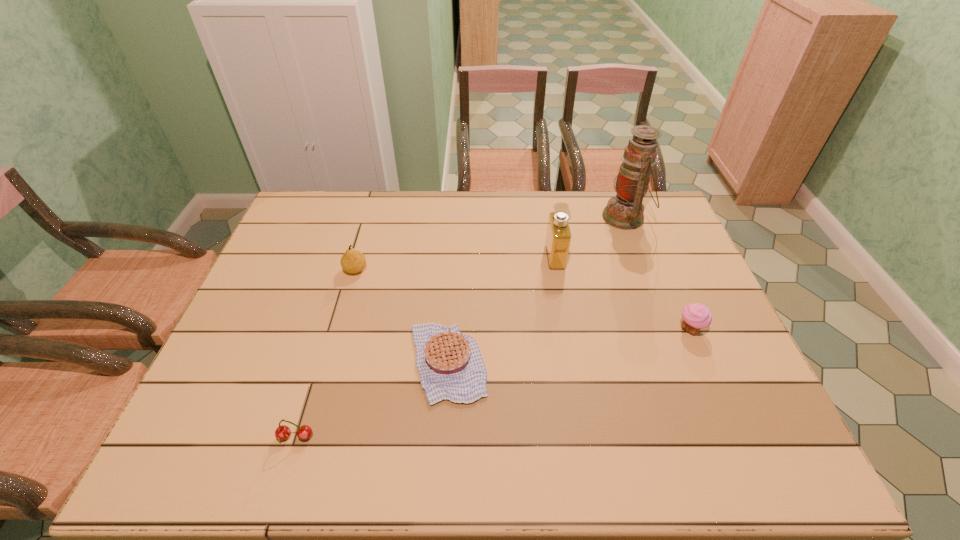
Locate an element on the screen. Image resolution: width=960 pixels, height=540 pixels. oil lamp is located at coordinates (624, 211).

The height and width of the screenshot is (540, 960). I want to click on the tallest object, so click(x=624, y=211).

The width and height of the screenshot is (960, 540). I want to click on the fifth shortest object, so pyautogui.click(x=558, y=236).

You are a GUI agent. You are given a task and a screenshot of the screen. Output one action in this format:
    pyautogui.click(x=<x>, y=<y>)
    Task: Click on the perfume
    The height and width of the screenshot is (540, 960).
    Given the screenshot: What is the action you would take?
    tap(558, 236)

Locate an element on the screen. This screenshot has width=960, height=540. the fourth shortest object is located at coordinates (352, 261).

Locate an element on the screen. cupcake is located at coordinates (696, 316).

Where is `cherry`? cherry is located at coordinates (304, 432).

Identify the location of pie. The image size is (960, 540). (450, 364).

Where is `the shortest object`? the shortest object is located at coordinates (450, 364).

At what (x,y) coordinates should I click in order to perform the action: click on free space located on the left of the oil lamp. Please return your answer as a coordinate pair (x, y). This screenshot has width=960, height=540. Looking at the image, I should click on (583, 217).